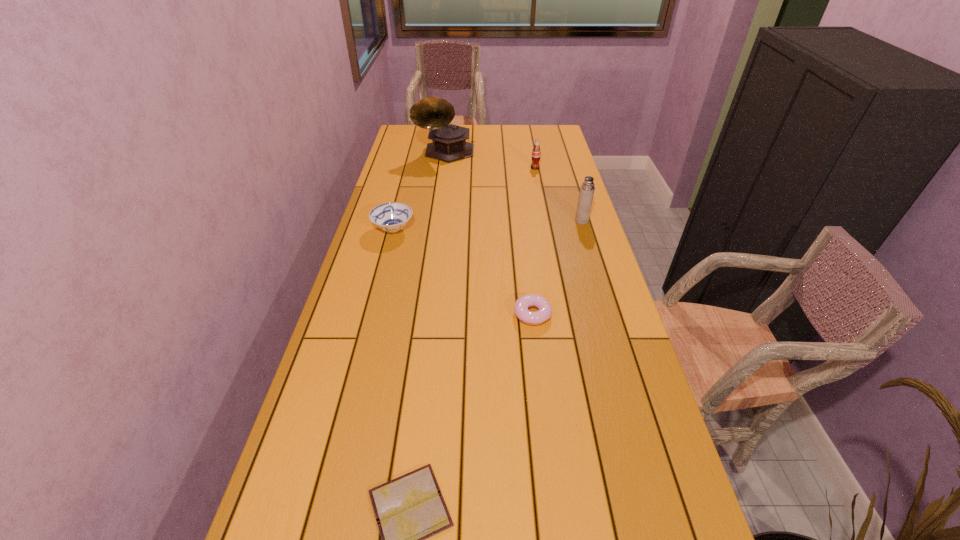
At what (x,y) coordinates should I click in order to perform the action: click on free spot at the left edge of the desktop. Please return your answer as a coordinate pair (x, y). Looking at the image, I should click on (393, 192).

In the image, there is a desktop. Identify the location of vacant space at the right edge. [x=542, y=194].

Where is `free point between the rightmost object and the soup bowl`? The image size is (960, 540). free point between the rightmost object and the soup bowl is located at coordinates (488, 225).

Identify the location of free point between the tallest object and the soup bowl. (420, 191).

What are the coordinates of `empty space between the soup bowl and the second shortest object` in the screenshot? It's located at (463, 272).

I want to click on vacant point located between the fourth shortest object and the rightmost object, so click(x=559, y=194).

At what (x,y) coordinates should I click in order to perform the action: click on free area in between the rightmost object and the third object from right to left. Please return your answer as a coordinate pair (x, y). This screenshot has height=540, width=960. Looking at the image, I should click on (557, 267).

Find the location of `vacant space that is in between the fourth object from left to right and the thermos bottle`. vacant space that is in between the fourth object from left to right and the thermos bottle is located at coordinates (557, 267).

Locate an element on the screen. The image size is (960, 540). vacant space that is in between the doughnut and the phonograph record is located at coordinates (489, 233).

This screenshot has height=540, width=960. Identify the location of free space between the fourth tallest object and the doughnut. (463, 272).